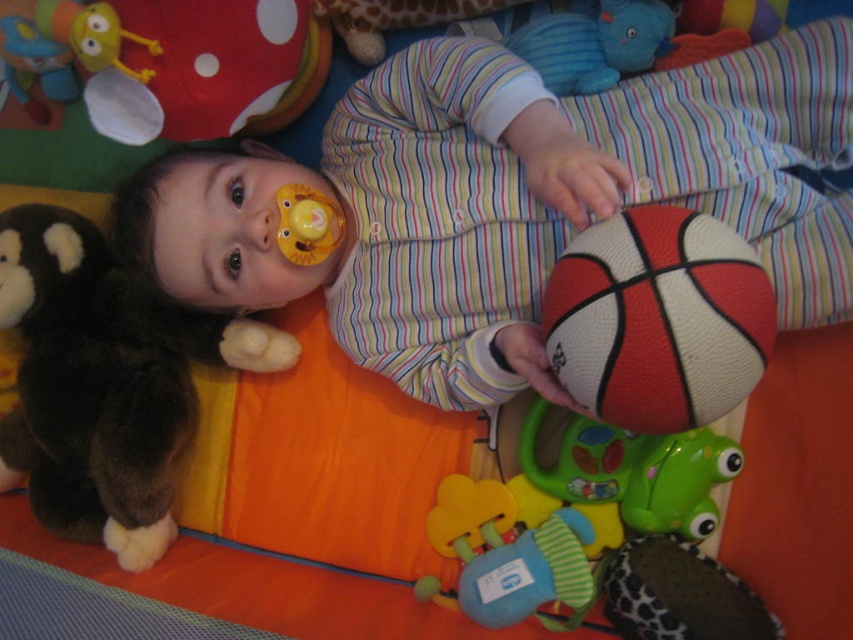
Question: In this image, where is striped fabric baby at center located relative to soft plush rattle at center?

Choices:
 (A) left
 (B) right

Answer: (A)

Question: Is striped fabric baby at center wider than soft plush rattle at center?

Choices:
 (A) no
 (B) yes

Answer: (B)

Question: Which point is farther to the camera?

Choices:
 (A) (664, 262)
 (B) (28, 340)
 (C) (825, 168)

Answer: (B)

Question: Does rubber basketball at center appear on the right side of green rubber frog at lower center?

Choices:
 (A) no
 (B) yes

Answer: (A)

Question: Which object appears closest to the camera in this image?

Choices:
 (A) rubber basketball at center
 (B) brown plush monkey at left
 (C) striped fabric baby at center

Answer: (A)

Question: Estimate the real-world distances between objects in this image. Which object is closer to the soft plush rattle at center?

Choices:
 (A) brown plush monkey at left
 (B) rubber basketball at center
 (C) green rubber frog at lower center

Answer: (C)